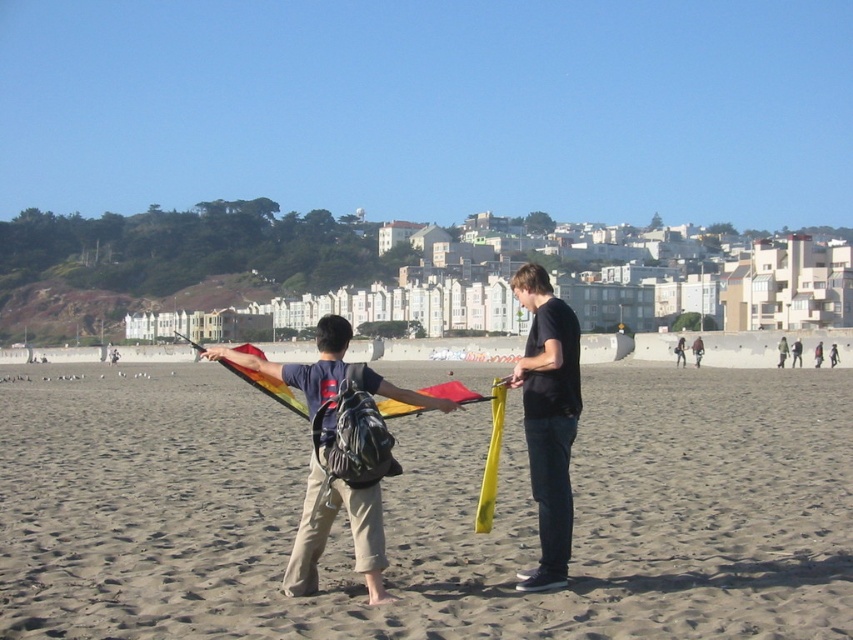
Question: Does sandy beach at center appear on the right side of rainbow fabric kite at center?

Choices:
 (A) no
 (B) yes

Answer: (B)

Question: Does matte black shirt at center have a larger size compared to rainbow fabric kite at center?

Choices:
 (A) yes
 (B) no

Answer: (B)

Question: In this image, where is matte black shirt at center located relative to rainbow fabric kite at center?

Choices:
 (A) above
 (B) below

Answer: (A)

Question: Which point appears closest to the camera in this image?

Choices:
 (A) (270, 557)
 (B) (495, 384)
 (C) (558, 349)

Answer: (A)

Question: Which point is closer to the camera?

Choices:
 (A) (548, 611)
 (B) (564, 560)
 (C) (480, 499)

Answer: (A)

Question: Which is nearer to the matte black shirt at center?

Choices:
 (A) sandy beach at center
 (B) rainbow fabric kite at center

Answer: (B)